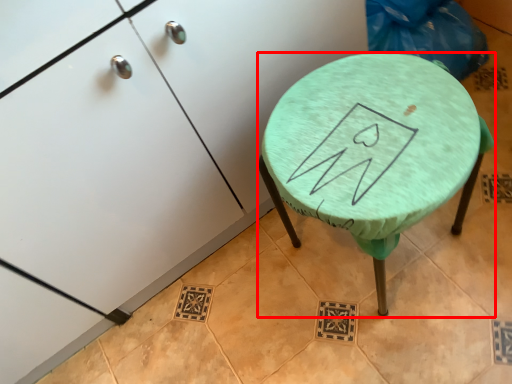
Question: Where is stool (annotated by the red box) located in relation to furniture in the image?

Choices:
 (A) left
 (B) right

Answer: (B)